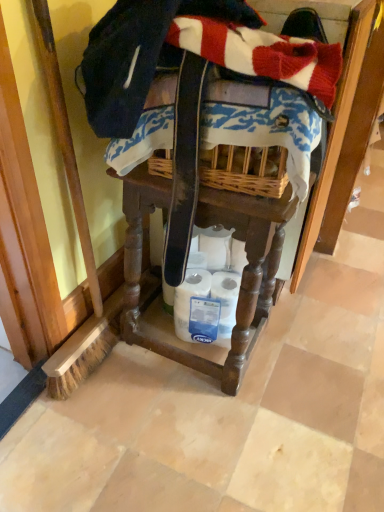
Question: Based on their positions, is white matte toilet paper at lower center located to the left or right of wooden vanity at center?

Choices:
 (A) right
 (B) left

Answer: (A)

Question: Is point (x=231, y=288) closer or farther from the camera than point (x=127, y=298)?

Choices:
 (A) closer
 (B) farther

Answer: (A)

Question: Which of these objects is positioned closest to the wooden vanity at center?

Choices:
 (A) white matte toilet paper at lower center
 (B) blue printed fabric at center

Answer: (A)

Question: Based on their relative distances, which object is farther from the white matte toilet paper at lower center?

Choices:
 (A) wooden vanity at center
 (B) blue printed fabric at center

Answer: (B)